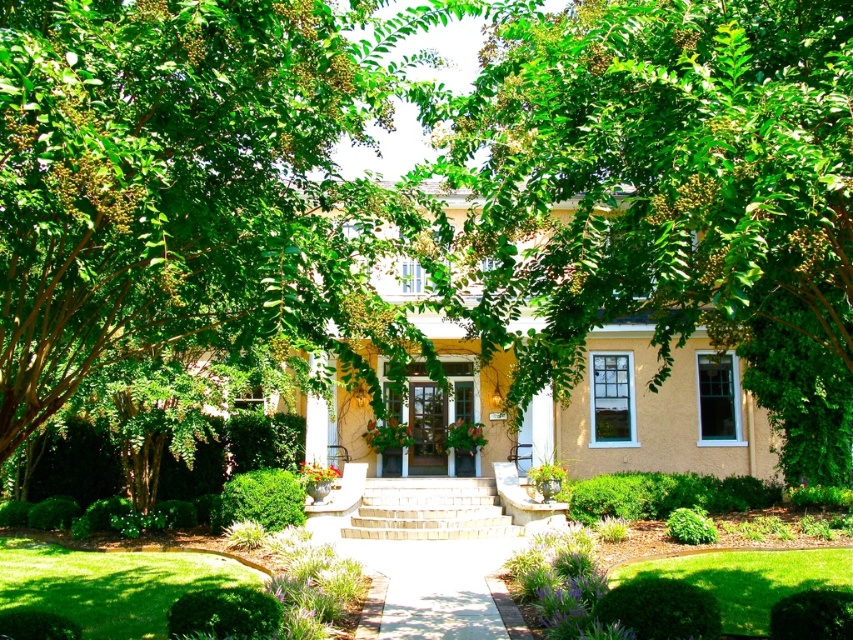
You are standing at the front door of the house and want to walk to the green grass at lower left. Which direction should you face to walk directly towards it?

The green grass at lower left is located at point (x=109, y=584), so you should face towards the lower left direction to walk directly towards it.

You are standing at the bottom of the steps leading to the house and want to walk to the front door. Which direction should you go relative to the green grass at lower left and the smooth concrete path at center?

The green grass at lower left is positioned on the left side of the smooth concrete path at center, so you should walk towards the smooth concrete path at center which is to the right of the green grass at lower left to reach the front door.

You are standing at the bottom of the brick steps leading to the house. You need to walk to the front door but want to avoid the smooth concrete path at center. Which direction should you walk to go around the green leafy tree at center?

To avoid the smooth concrete path at center and go around the green leafy tree at center, you should walk to the left or right side of the tree since the tree is taller than the path and likely obstructs the path directly in front of it.